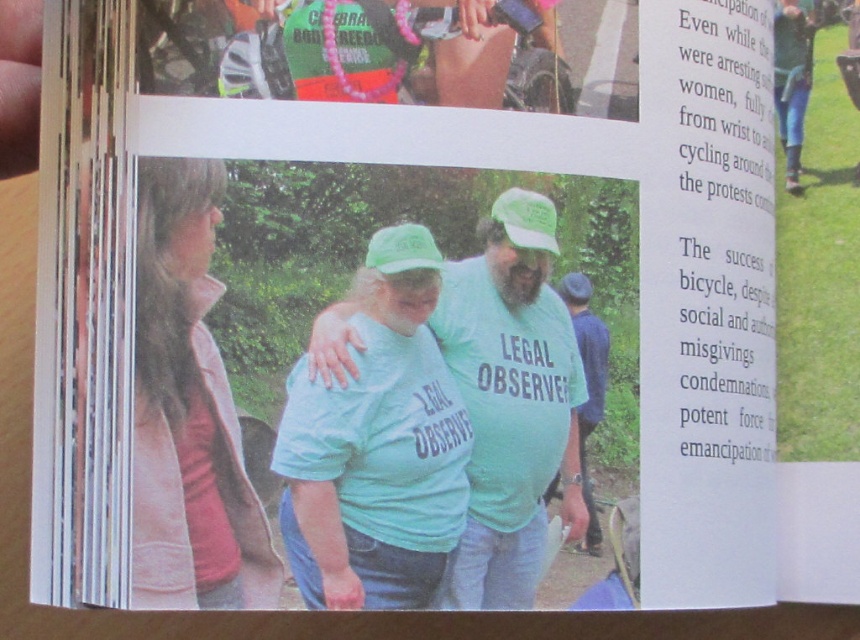
Question: Which point is closer to the camera?

Choices:
 (A) (180, 349)
 (B) (516, 560)
 (C) (427, 384)

Answer: (A)

Question: Is light blue fabric shirt at center to the left of pink fleece jacket at left from the viewer's perspective?

Choices:
 (A) yes
 (B) no

Answer: (B)

Question: Is light blue t-shirt at center smaller than pink fleece jacket at left?

Choices:
 (A) no
 (B) yes

Answer: (A)

Question: Which object is closer to the camera taking this photo?

Choices:
 (A) light blue t-shirt at center
 (B) light blue fabric shirt at center
 (C) pink fleece jacket at left

Answer: (C)

Question: Based on their relative distances, which object is farther from the light blue t-shirt at center?

Choices:
 (A) pink fleece jacket at left
 (B) light blue fabric shirt at center

Answer: (A)

Question: Is light blue t-shirt at center bigger than pink fleece jacket at left?

Choices:
 (A) yes
 (B) no

Answer: (A)